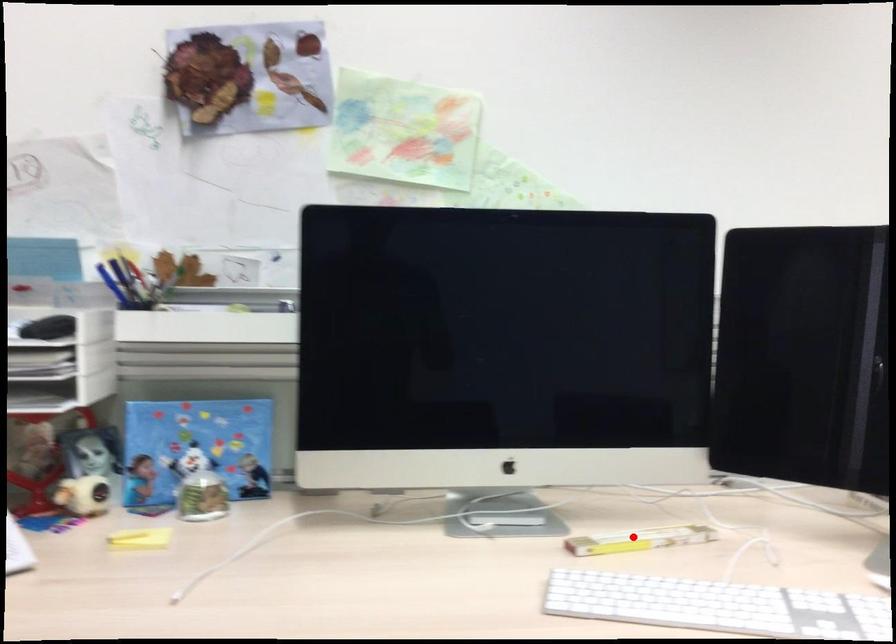
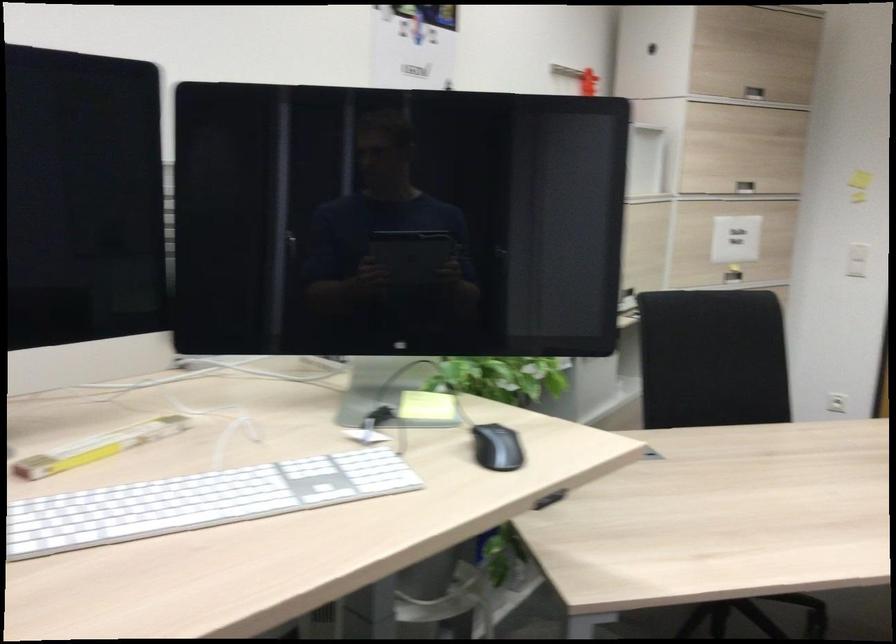
In the second image, find the point that corresponds to the highlighted location in the first image.

(98, 447)